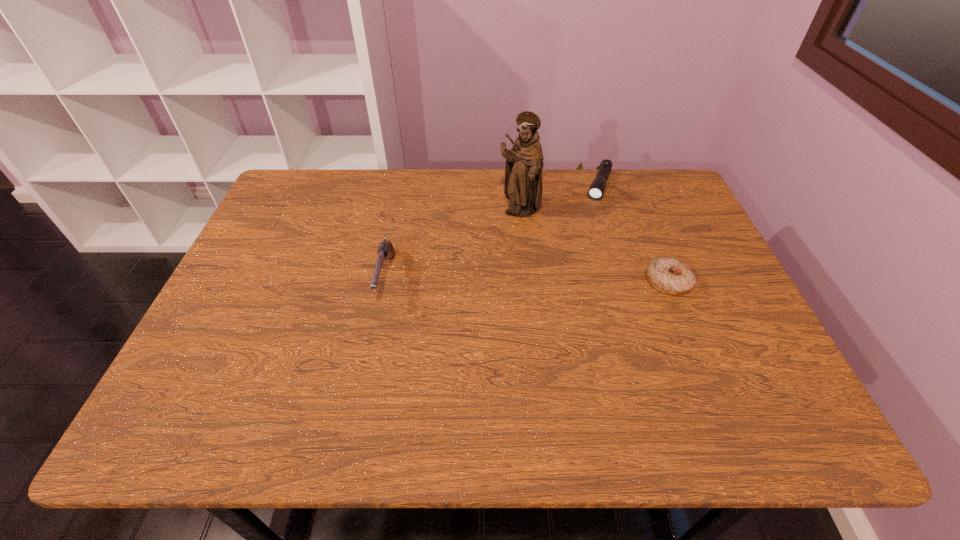
At what (x,y) coordinates should I click in order to perform the action: click on free spot located 0.400m on the front-facing side of the second object from left to right. Please return your answer as a coordinate pair (x, y). The width and height of the screenshot is (960, 540). Looking at the image, I should click on (530, 339).

This screenshot has height=540, width=960. I want to click on vacant space situated 0.060m at the lens end of the flashlight, so click(593, 212).

Where is `vacant space located at the lens end of the flashlight`? The height and width of the screenshot is (540, 960). vacant space located at the lens end of the flashlight is located at coordinates (565, 287).

Find the location of a particular element. vacant space located 0.400m at the lens end of the flashlight is located at coordinates (564, 289).

Where is `figurine that is at the far edge`? figurine that is at the far edge is located at coordinates (523, 186).

The width and height of the screenshot is (960, 540). I want to click on flashlight present at the far edge, so click(596, 190).

Locate an element on the screen. The height and width of the screenshot is (540, 960). object located at the right edge is located at coordinates (671, 276).

Where is `vacant area at the far edge`? The height and width of the screenshot is (540, 960). vacant area at the far edge is located at coordinates (613, 209).

Where is `free space at the near edge`? The height and width of the screenshot is (540, 960). free space at the near edge is located at coordinates (680, 377).

In order to click on vacant space at the left edge of the desktop in this screenshot , I will do `click(276, 308)`.